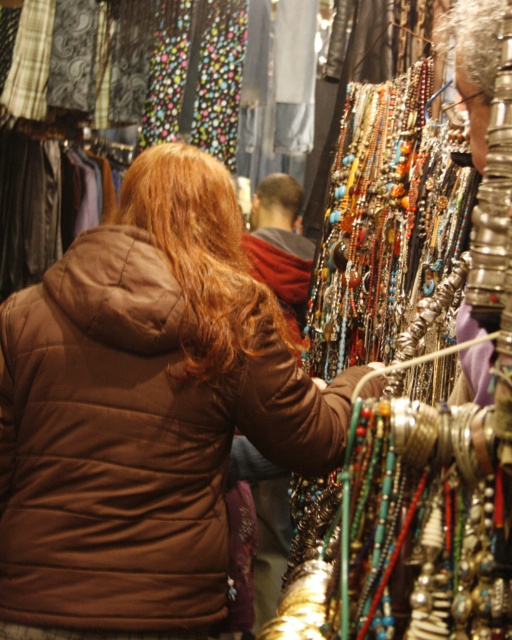
Is brown quilted jacket at center shorter than brown wavy hair at center?

No.

This screenshot has height=640, width=512. Identify the location of brown quilted jacket at center. (133, 444).

Does point (193, 488) come in front of point (266, 292)?

Yes.

This screenshot has width=512, height=640. Find the location of `brown quilted jacket at center`. brown quilted jacket at center is located at coordinates (133, 444).

Who is positioned more to the right, brown wavy hair at center or brown shiny hair at upper center?

Positioned to the right is brown shiny hair at upper center.

Which is more to the left, brown wavy hair at center or brown shiny hair at upper center?

brown wavy hair at center

This screenshot has height=640, width=512. I want to click on brown wavy hair at center, so click(x=200, y=256).

Is point (159, 557) less distant than point (284, 212)?

Yes, it is.

Consider the image. Can you confirm if brown quilted jacket at center is bigger than brown shiny hair at upper center?

Correct, brown quilted jacket at center is larger in size than brown shiny hair at upper center.

Is point (160, 380) positioned after point (291, 196)?

No, (160, 380) is closer to viewer.

Locate an element on the screen. The height and width of the screenshot is (640, 512). brown quilted jacket at center is located at coordinates (133, 444).